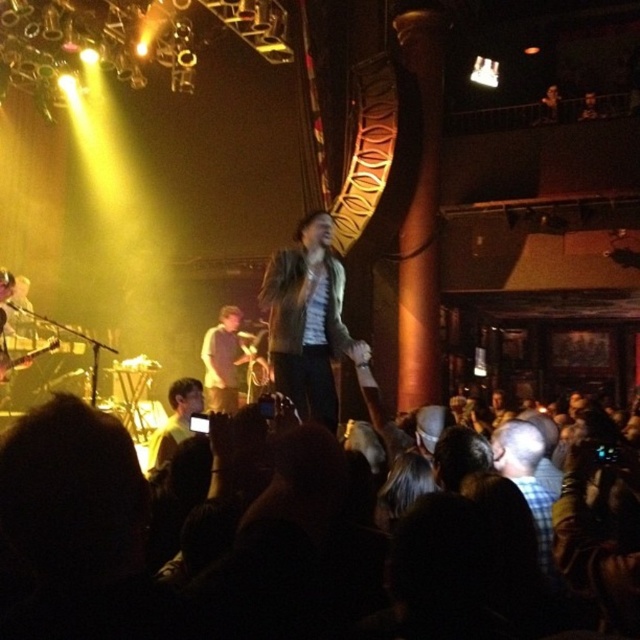
You are a photographer at the concert and want to take a closeup shot of the leather jacket at center without including the dark brown leather jacket at lower left. Which one is closer to your camera lens?

The leather jacket at center is closer to the camera lens than the dark brown leather jacket at lower left, so you can focus on it to exclude the other.

You are a photographer positioned at the back of the venue. You want to take a photo of the stage. There are two points marked on your camera screen at coordinates point [284,289] and point [180,410]. Which point is closer to you?

Point [180,410] is further away from you than point [284,289], so point [284,289] is closer to you.